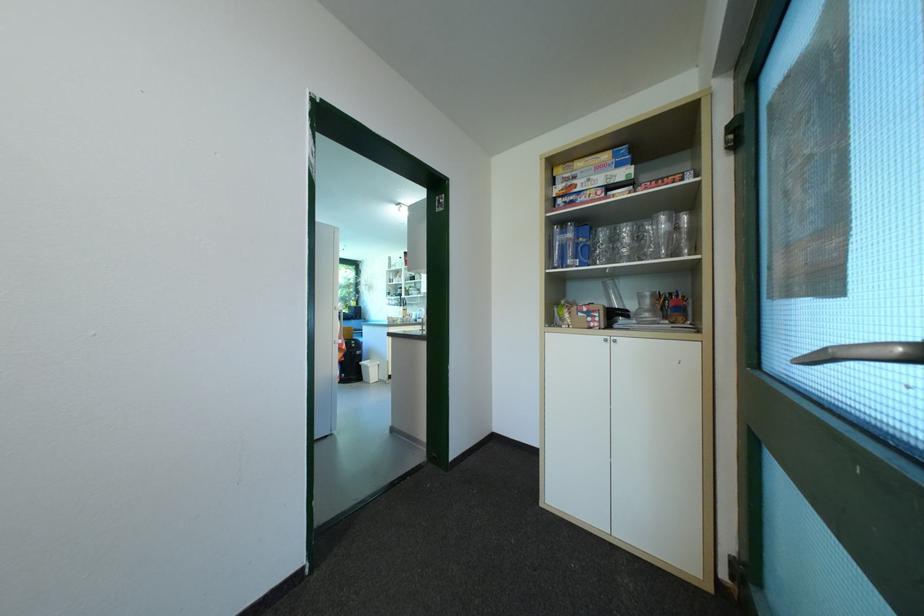
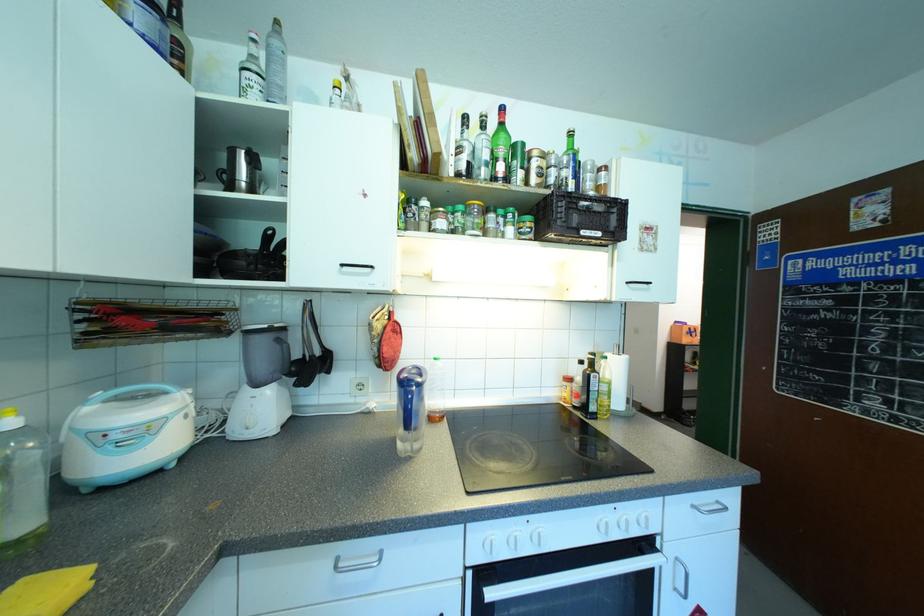
Question: I am providing you with two images of the same scene from different viewpoints. After the viewpoint changes to image2, which objects are now occluded?

Choices:
 (A) blue game box
 (B) red electronic box
 (C) clear glass bottle
 (D) green glass bottle

Answer: (A)